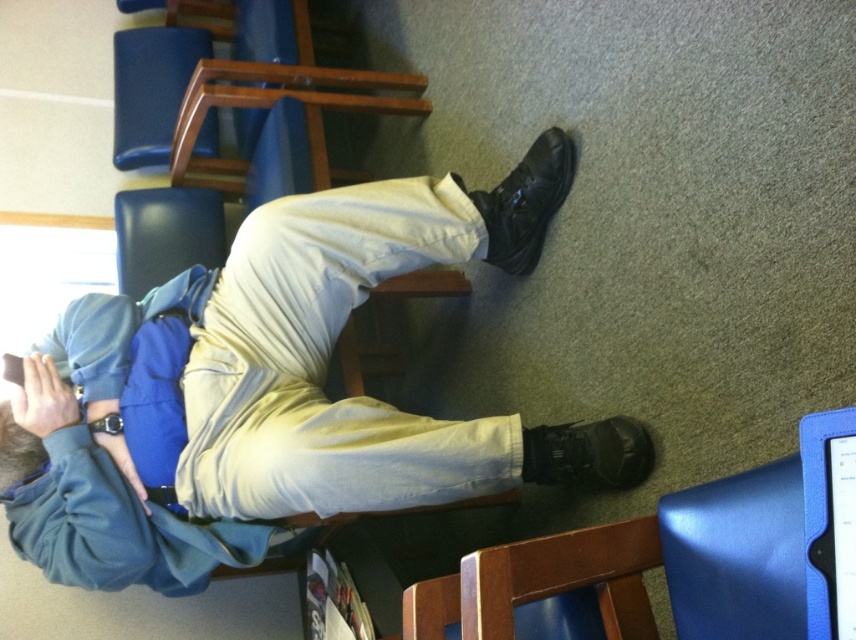
You are a delivery person who needs to place a small package between the matte black shoe at lower right and the matte black hair at lower left. Can you fit it there?

The distance between the matte black shoe at lower right and the matte black hair at lower left is 42.21 centimeters. If the package is smaller than this distance, it can fit.

You are standing in a waiting area and want to place your keys on the nearest available surface. You see the blue leather tablet at lower right. Where should you place your keys?

You should place your keys on the blue leather tablet at lower right since it is the nearest available surface at point (829, 522).

You are a service robot in a waiting area. You need to pick up the blue leather tablet at lower right and the black leather boot at lower center. Which object should you pick up first if you want to avoid moving the other object?

You should pick up the blue leather tablet at lower right first because it is in front of the black leather boot at lower center, so moving the tablet first would avoid disturbing the boot.